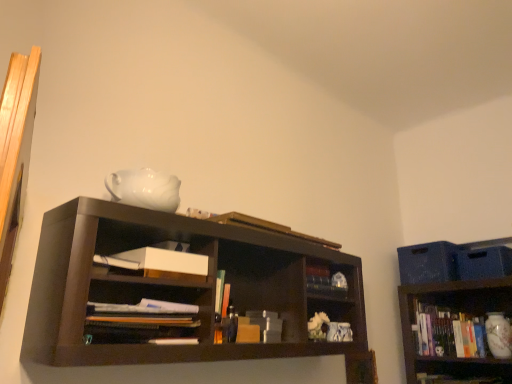
Question: Considering the relative positions of white matte paper at center and white paper at center, marked as the 3th book in a right-to-left arrangement, in the image provided, is white matte paper at center behind white paper at center, marked as the 3th book in a right-to-left arrangement,?

Choices:
 (A) yes
 (B) no

Answer: (A)

Question: Is white matte paper at center aimed at white paper at center, acting as the 1th book starting from the left?

Choices:
 (A) yes
 (B) no

Answer: (B)

Question: Is white matte paper at center turned away from white paper at center, arranged as the second book when viewed from the top?

Choices:
 (A) no
 (B) yes

Answer: (A)

Question: Is white matte paper at center next to white paper at center, positioned as the 2th book in bottom-to-top order?

Choices:
 (A) yes
 (B) no

Answer: (B)

Question: From a real-world perspective, is white matte paper at center physically above white paper at center, placed as the 1th book when sorted from front to back?

Choices:
 (A) no
 (B) yes

Answer: (B)

Question: Relative to white glossy vase at lower right, the 1th book in the back-to-front sequence, is white matte paper at center in front or behind?

Choices:
 (A) front
 (B) behind

Answer: (A)

Question: Does point (177, 259) appear closer or farther from the camera than point (443, 307)?

Choices:
 (A) closer
 (B) farther

Answer: (A)

Question: In terms of width, does white matte paper at center look wider or thinner when compared to white glossy vase at lower right, the 1th book ordered from the bottom?

Choices:
 (A) thin
 (B) wide

Answer: (A)

Question: From a real-world perspective, is white matte paper at center above or below white glossy vase at lower right, marked as the third book in a front-to-back arrangement?

Choices:
 (A) below
 (B) above

Answer: (B)

Question: From the image's perspective, is white paper at center, arranged as the second book when viewed from the top, located above or below white glossy vase at lower right, acting as the 1th book starting from the right?

Choices:
 (A) below
 (B) above

Answer: (B)

Question: Considering their positions, is white paper at center, positioned as the 2th book in bottom-to-top order, located in front of or behind white glossy vase at lower right, which ranks as the third book in top-to-bottom order?

Choices:
 (A) front
 (B) behind

Answer: (A)

Question: Is white paper at center, positioned as the 2th book in bottom-to-top order, to the left or to the right of white glossy vase at lower right, marked as the third book in a front-to-back arrangement, in the image?

Choices:
 (A) left
 (B) right

Answer: (A)

Question: Looking at the image, does white paper at center, which is the third book from back to front, seem bigger or smaller compared to white glossy vase at lower right, the 3th book viewed from the left?

Choices:
 (A) big
 (B) small

Answer: (B)

Question: Looking at their shapes, would you say white glossy vase at lower right, the 1th book in the back-to-front sequence, is wider or thinner than gold metallic book at upper center, acting as the 1th book starting from the top?

Choices:
 (A) thin
 (B) wide

Answer: (B)

Question: Is white glossy vase at lower right, marked as the third book in a front-to-back arrangement, situated inside gold metallic book at upper center, which ranks as the third book in bottom-to-top order, or outside?

Choices:
 (A) outside
 (B) inside

Answer: (A)